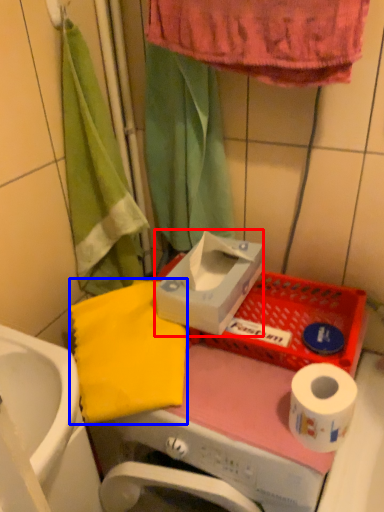
Question: Among these objects, which one is nearest to the camera, carton (highlighted by a red box) or beach towel (highlighted by a blue box)?

Choices:
 (A) carton
 (B) beach towel

Answer: (B)